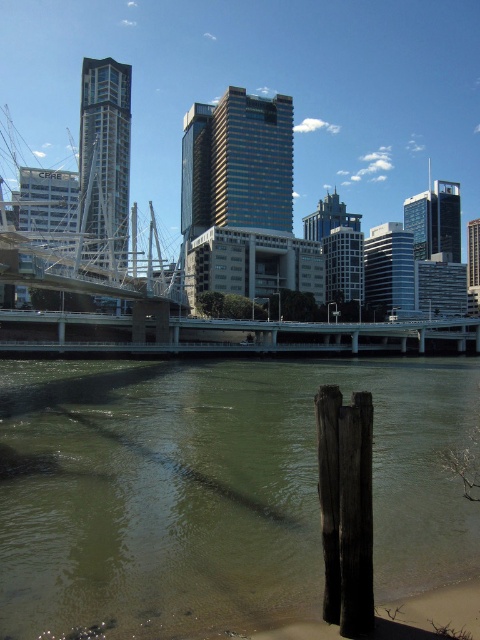
You are a photographer planning to take a photo of the brown wood post at lower right and the concrete bridge at center. Based on their heights, which object should you focus on first if you want to ensure both are in frame without moving the camera?

The brown wood post at lower right is shorter than the concrete bridge at center, so you should focus on the concrete bridge at center first to ensure both are in frame.